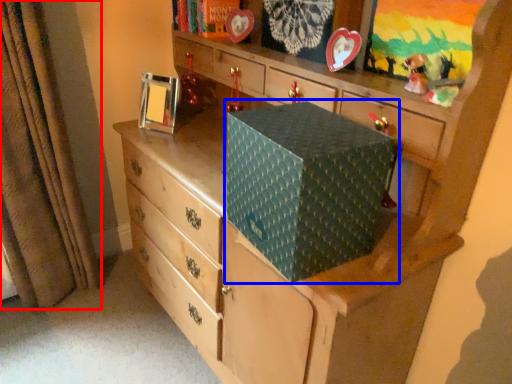
Question: Which of the following is the farthest to the observer, curtain (highlighted by a red box) or cardboard box (highlighted by a blue box)?

Choices:
 (A) curtain
 (B) cardboard box

Answer: (A)